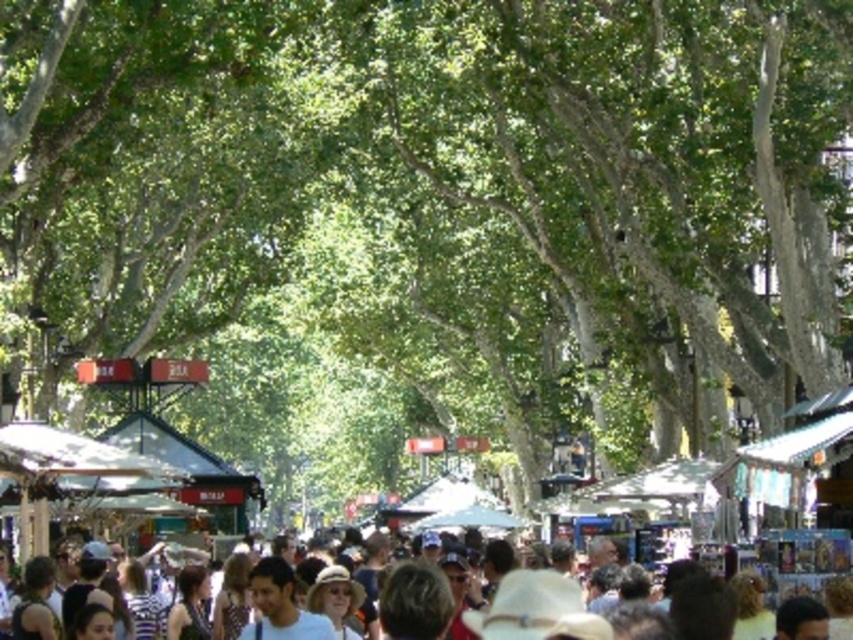
Question: Does multicolored fabric crowd at center appear over light brown hair at center?

Choices:
 (A) no
 (B) yes

Answer: (A)

Question: Does multicolored fabric crowd at center appear under light brown hair at center?

Choices:
 (A) yes
 (B) no

Answer: (A)

Question: Which point is closer to the camera?

Choices:
 (A) multicolored fabric crowd at center
 (B) light brown hair at center

Answer: (A)

Question: Can you confirm if multicolored fabric crowd at center is positioned to the right of light brown hair at center?

Choices:
 (A) no
 (B) yes

Answer: (A)

Question: Which point appears closest to the camera in this image?

Choices:
 (A) (263, 596)
 (B) (123, 636)

Answer: (A)